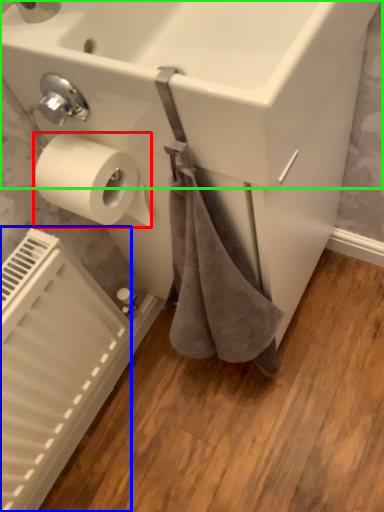
Question: Based on their relative distances, which object is nearer to toilet paper (highlighted by a red box)? Choose from radiator (highlighted by a blue box) and sink (highlighted by a green box).

Choices:
 (A) radiator
 (B) sink

Answer: (B)